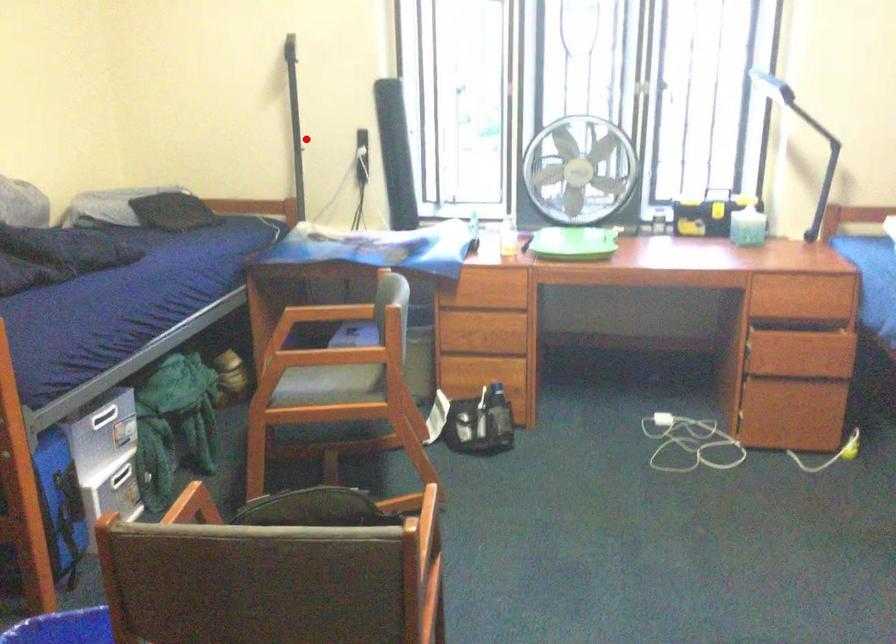
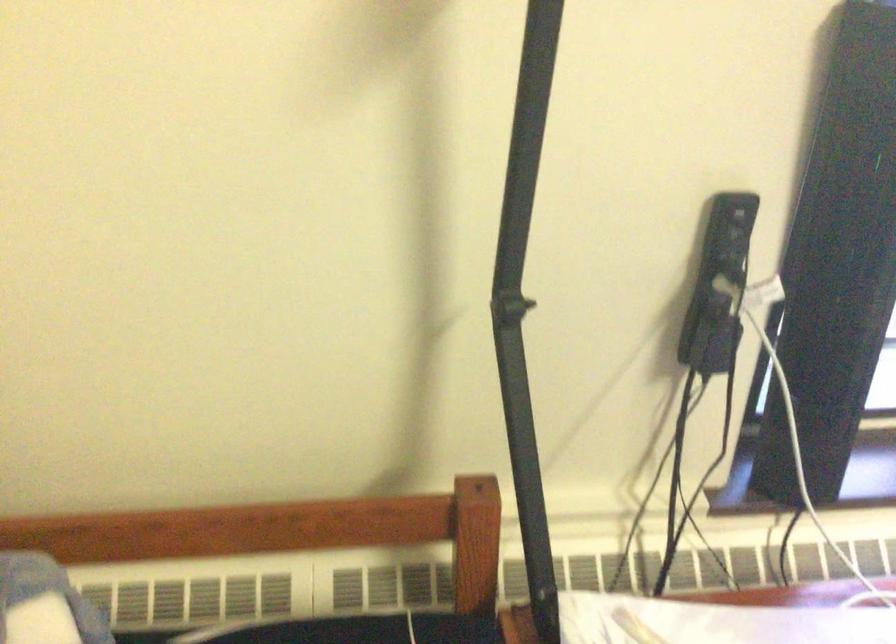
Find the pixel in the second image that matches the highlighted location in the first image.

(524, 305)